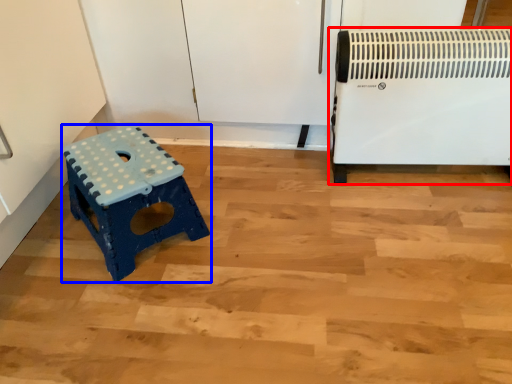
Question: Which point is closer to the camera, home appliance (highlighted by a red box) or furniture (highlighted by a blue box)?

Choices:
 (A) home appliance
 (B) furniture

Answer: (B)